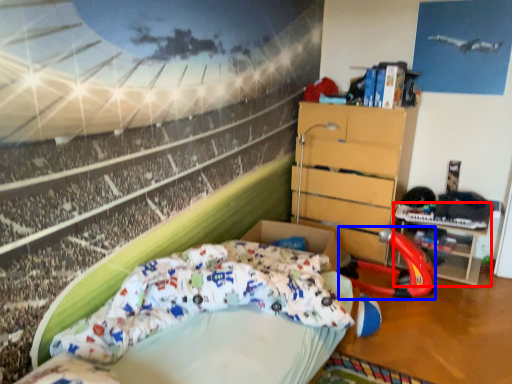
Question: Which point is closer to the camera, table (highlighted by a red box) or sport equipment (highlighted by a blue box)?

Choices:
 (A) table
 (B) sport equipment

Answer: (B)